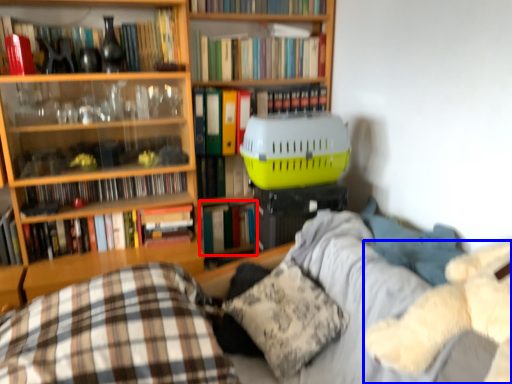
Question: Which of the following is the closest to the observer, book (highlighted by a red box) or teddy (highlighted by a blue box)?

Choices:
 (A) book
 (B) teddy

Answer: (B)